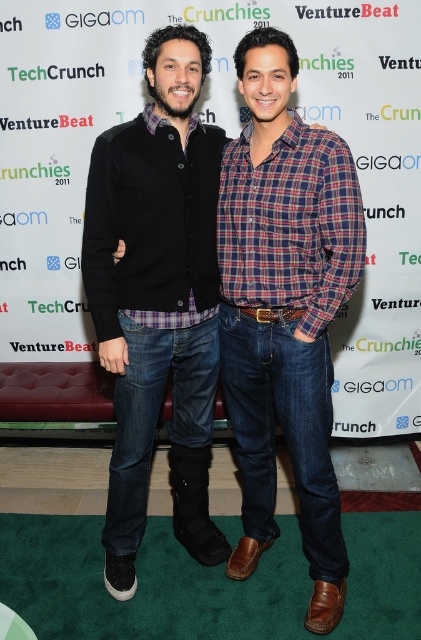
Question: Which object is closer to the camera taking this photo?

Choices:
 (A) plaid cotton shirt at center
 (B) black matte sweater at center

Answer: (A)

Question: In this image, where is plaid cotton shirt at center located relative to black matte sweater at center?

Choices:
 (A) left
 (B) right

Answer: (B)

Question: Does plaid cotton shirt at center have a lesser width compared to black matte sweater at center?

Choices:
 (A) yes
 (B) no

Answer: (A)

Question: Is plaid cotton shirt at center smaller than black matte sweater at center?

Choices:
 (A) no
 (B) yes

Answer: (B)